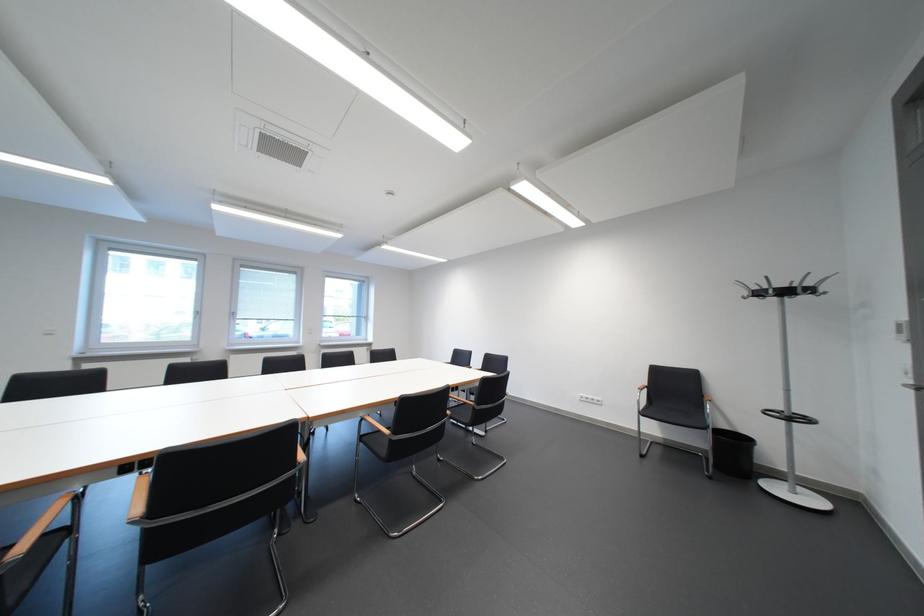
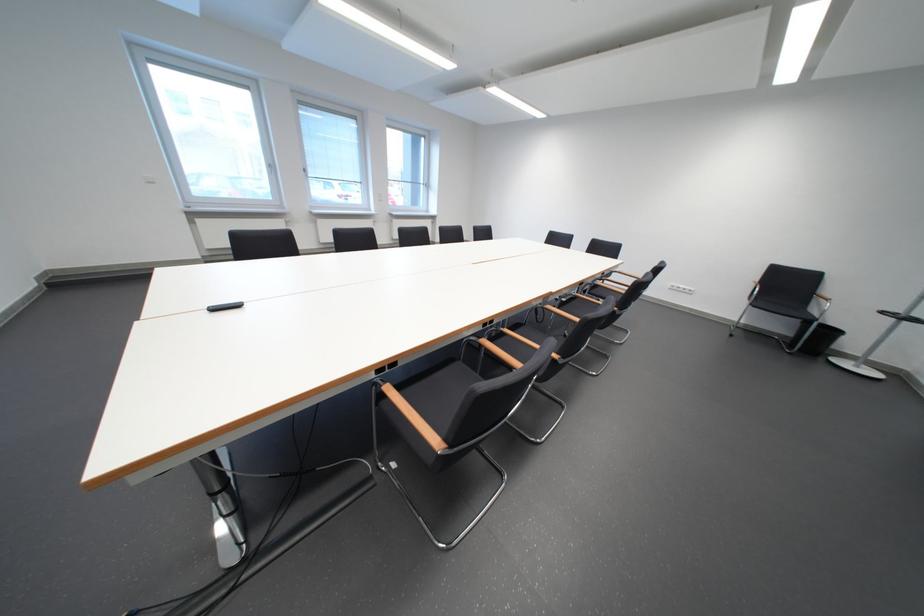
Question: What movement of the cameraman would produce the second image?

Choices:
 (A) Left
 (B) Right
 (C) Forward
 (D) Backward

Answer: (A)